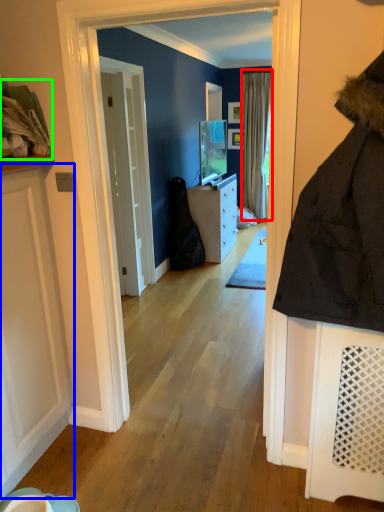
Question: Estimate the real-world distances between objects in this image. Which object is farther from curtain (highlighted by a red box), door (highlighted by a blue box) or laundry (highlighted by a green box)?

Choices:
 (A) door
 (B) laundry

Answer: (B)